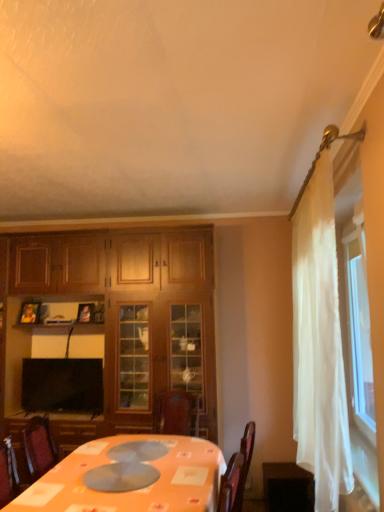
Question: From the image's perspective, is black glossy tv at lower left above or below dark wood table at lower right?

Choices:
 (A) above
 (B) below

Answer: (A)

Question: Considering the positions of point (86, 374) and point (301, 496), is point (86, 374) closer or farther from the camera than point (301, 496)?

Choices:
 (A) closer
 (B) farther

Answer: (B)

Question: Which object is the farthest from the white sheer curtain at right?

Choices:
 (A) wooden cabinet at left
 (B) wooden picture frame at upper left, which ranks as the 1th picture frame in left-to-right order
 (C) matte black picture frame at upper left, the first picture frame in the right-to-left sequence
 (D) orange fabric table at lower center
 (E) black glossy tv at lower left

Answer: (B)

Question: Which object is the farthest from the wooden cabinet at left?

Choices:
 (A) black glossy tv at lower left
 (B) matte black picture frame at upper left, the first picture frame in the right-to-left sequence
 (C) dark wood table at lower right
 (D) wooden picture frame at upper left, which is the second picture frame in right-to-left order
 (E) white sheer curtain at right

Answer: (E)